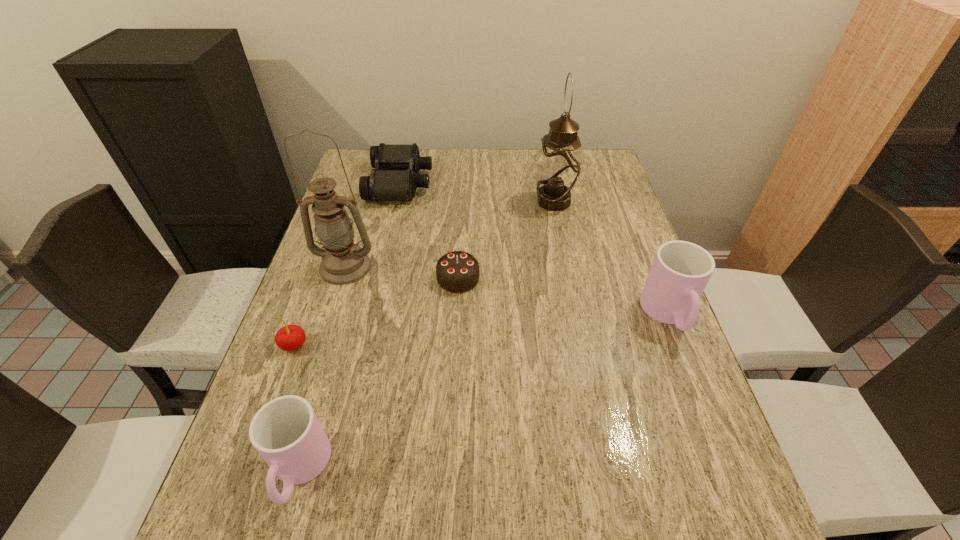
Please determine a free point for an extra cup to ensure balance. Please provide its 2D coordinates. Your answer should be formatted as a tuple, i.e. [(x, y)], where the tuple contains the x and y coordinates of a point satisfying the conditions above.

[(510, 382)]